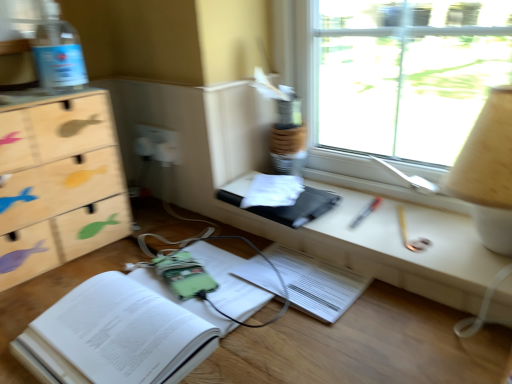
Question: Are green fabric book at lower left, positioned as the 1th paperback book in bottom-to-top order, and wooden fish-patterned chest of drawers at left making contact?

Choices:
 (A) yes
 (B) no

Answer: (B)

Question: Is green fabric book at lower left, arranged as the 2th paperback book when viewed from the top, outside wooden fish-patterned chest of drawers at left?

Choices:
 (A) yes
 (B) no

Answer: (A)

Question: Is green fabric book at lower left, arranged as the 2th paperback book when viewed from the top, surrounding wooden fish-patterned chest of drawers at left?

Choices:
 (A) no
 (B) yes

Answer: (A)

Question: From the image's perspective, does green fabric book at lower left, positioned as the 1th paperback book in bottom-to-top order, appear lower than wooden fish-patterned chest of drawers at left?

Choices:
 (A) yes
 (B) no

Answer: (A)

Question: Can you confirm if green fabric book at lower left, arranged as the 2th paperback book when viewed from the top, is taller than wooden fish-patterned chest of drawers at left?

Choices:
 (A) no
 (B) yes

Answer: (A)

Question: In terms of height, does transparent glass window at upper right look taller or shorter compared to beige fabric lampshade at upper right?

Choices:
 (A) tall
 (B) short

Answer: (A)

Question: Considering the positions of transparent glass window at upper right and beige fabric lampshade at upper right in the image, is transparent glass window at upper right bigger or smaller than beige fabric lampshade at upper right?

Choices:
 (A) small
 (B) big

Answer: (B)

Question: Is transparent glass window at upper right wider or thinner than beige fabric lampshade at upper right?

Choices:
 (A) wide
 (B) thin

Answer: (B)

Question: From a real-world perspective, is transparent glass window at upper right physically located above or below beige fabric lampshade at upper right?

Choices:
 (A) below
 (B) above

Answer: (B)

Question: In terms of height, does green fabric book at lower left, positioned as the 1th paperback book in bottom-to-top order, look taller or shorter compared to transparent glass window at upper right?

Choices:
 (A) short
 (B) tall

Answer: (A)

Question: Considering the positions of green fabric book at lower left, arranged as the 2th paperback book when viewed from the top, and transparent glass window at upper right in the image, is green fabric book at lower left, arranged as the 2th paperback book when viewed from the top, bigger or smaller than transparent glass window at upper right?

Choices:
 (A) big
 (B) small

Answer: (B)

Question: From a real-world perspective, relative to transparent glass window at upper right, is green fabric book at lower left, positioned as the 1th paperback book in bottom-to-top order, vertically above or below?

Choices:
 (A) below
 (B) above

Answer: (A)

Question: Considering the positions of point (111, 314) and point (503, 64), is point (111, 314) closer or farther from the camera than point (503, 64)?

Choices:
 (A) closer
 (B) farther

Answer: (A)

Question: Would you say wooden fish-patterned chest of drawers at left is to the left or to the right of white plastic electric outlet at center in the picture?

Choices:
 (A) left
 (B) right

Answer: (A)

Question: From a real-world perspective, is wooden fish-patterned chest of drawers at left above or below white plastic electric outlet at center?

Choices:
 (A) above
 (B) below

Answer: (A)